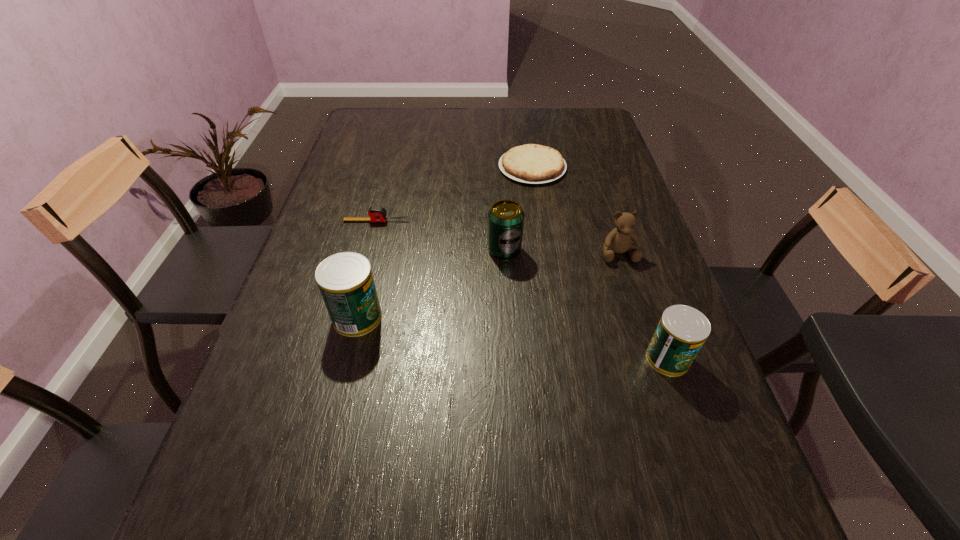
In the image, there is a desktop. Where is `free space at the far edge`? This screenshot has height=540, width=960. free space at the far edge is located at coordinates (495, 134).

The width and height of the screenshot is (960, 540). What are the coordinates of `free space at the near edge` in the screenshot? It's located at (493, 459).

This screenshot has height=540, width=960. In the image, there is a desktop. Identify the location of vacant space at the left edge. (284, 349).

Locate an element on the screen. The height and width of the screenshot is (540, 960). vacant space at the right edge of the desktop is located at coordinates (599, 150).

Where is `vacant space at the far left corner of the desktop`? The width and height of the screenshot is (960, 540). vacant space at the far left corner of the desktop is located at coordinates (388, 118).

Locate an element on the screen. The height and width of the screenshot is (540, 960). free space at the far right corner of the desktop is located at coordinates 594,138.

Locate an element on the screen. Image resolution: width=960 pixels, height=540 pixels. free location at the near right corner is located at coordinates (670, 452).

Where is `vacant area between the tortilla and the teddy bear`? vacant area between the tortilla and the teddy bear is located at coordinates (575, 210).

You are a GUI agent. You are given a task and a screenshot of the screen. Output one action in this format:
    pyautogui.click(x=<x>, y=<y>)
    Task: Click on the unoccupied position between the farthest object and the teddy bear
    
    Given the screenshot: What is the action you would take?
    pyautogui.click(x=575, y=210)

Locate an element on the screen. The image size is (960, 540). unoccupied area between the beer can and the nearer can is located at coordinates (586, 304).